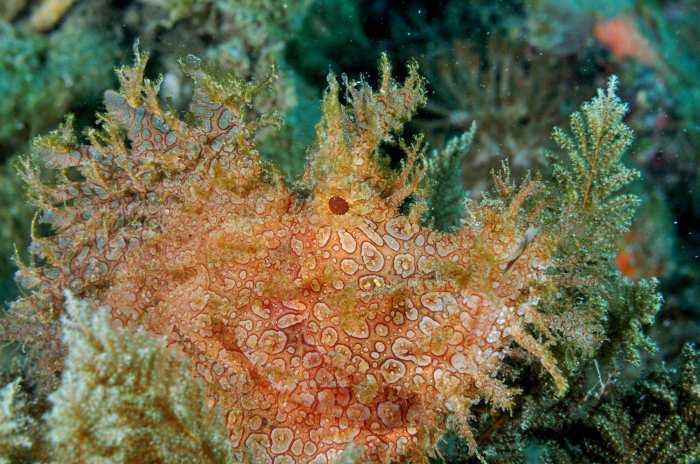
Find the location of a particular element. plant is located at coordinates (607, 150).